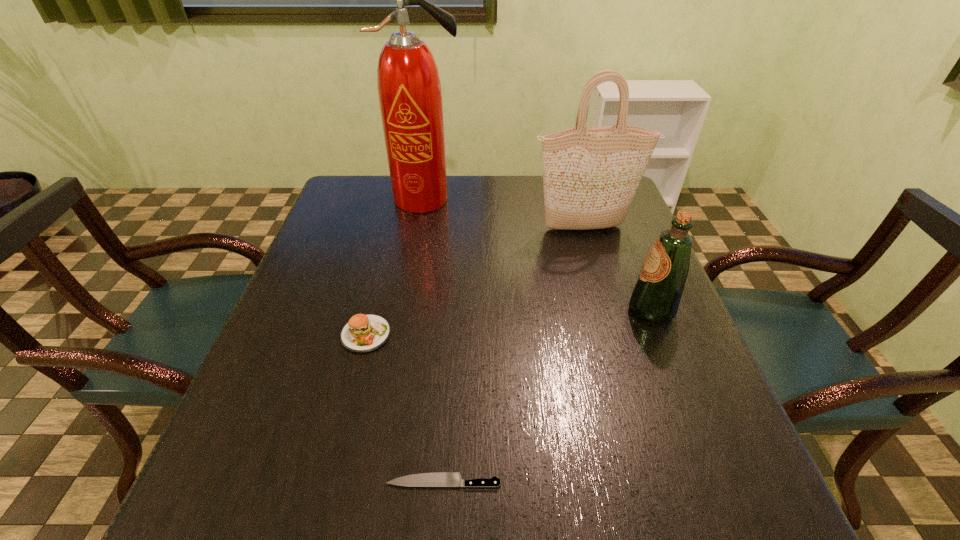
I want to click on free spot that satisfies the following two spatial constraints: 1. on the back side of the fire extinguisher; 2. on the left side of the second shortest object, so click(x=399, y=199).